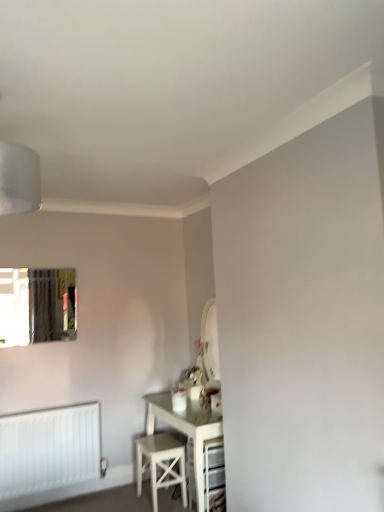
Question: Is clear glass mirror at upper left further to camera compared to white wood stool at lower center?

Choices:
 (A) no
 (B) yes

Answer: (B)

Question: Is clear glass mirror at upper left bigger than white wood stool at lower center?

Choices:
 (A) yes
 (B) no

Answer: (B)

Question: Is white wood stool at lower center located within clear glass mirror at upper left?

Choices:
 (A) yes
 (B) no

Answer: (B)

Question: Considering the relative sizes of clear glass mirror at upper left and white wood stool at lower center in the image provided, is clear glass mirror at upper left thinner than white wood stool at lower center?

Choices:
 (A) yes
 (B) no

Answer: (A)

Question: Considering the relative sizes of clear glass mirror at upper left and white wood stool at lower center in the image provided, is clear glass mirror at upper left taller than white wood stool at lower center?

Choices:
 (A) yes
 (B) no

Answer: (A)

Question: Does point (28, 477) appear closer or farther from the camera than point (44, 316)?

Choices:
 (A) closer
 (B) farther

Answer: (A)

Question: Considering the positions of white matte radiator at lower left and clear glass mirror at upper left in the image, is white matte radiator at lower left taller or shorter than clear glass mirror at upper left?

Choices:
 (A) tall
 (B) short

Answer: (A)

Question: Would you say white matte radiator at lower left is to the left or to the right of clear glass mirror at upper left in the picture?

Choices:
 (A) left
 (B) right

Answer: (B)

Question: From a real-world perspective, is white matte radiator at lower left physically located above or below clear glass mirror at upper left?

Choices:
 (A) above
 (B) below

Answer: (B)

Question: In terms of size, does clear glass mirror at upper left appear bigger or smaller than white matte radiator at lower left?

Choices:
 (A) big
 (B) small

Answer: (B)

Question: Considering the positions of point (1, 326) and point (38, 420), is point (1, 326) closer or farther from the camera than point (38, 420)?

Choices:
 (A) farther
 (B) closer

Answer: (A)

Question: Considering their positions, is clear glass mirror at upper left located in front of or behind white matte radiator at lower left?

Choices:
 (A) behind
 (B) front

Answer: (A)

Question: Based on their positions, is clear glass mirror at upper left located to the left or right of white matte radiator at lower left?

Choices:
 (A) left
 (B) right

Answer: (A)

Question: Is point (11, 303) positioned closer to the camera than point (140, 458)?

Choices:
 (A) farther
 (B) closer

Answer: (B)

Question: From a real-world perspective, is clear glass mirror at upper left positioned above or below white wood stool at lower center?

Choices:
 (A) below
 (B) above

Answer: (B)